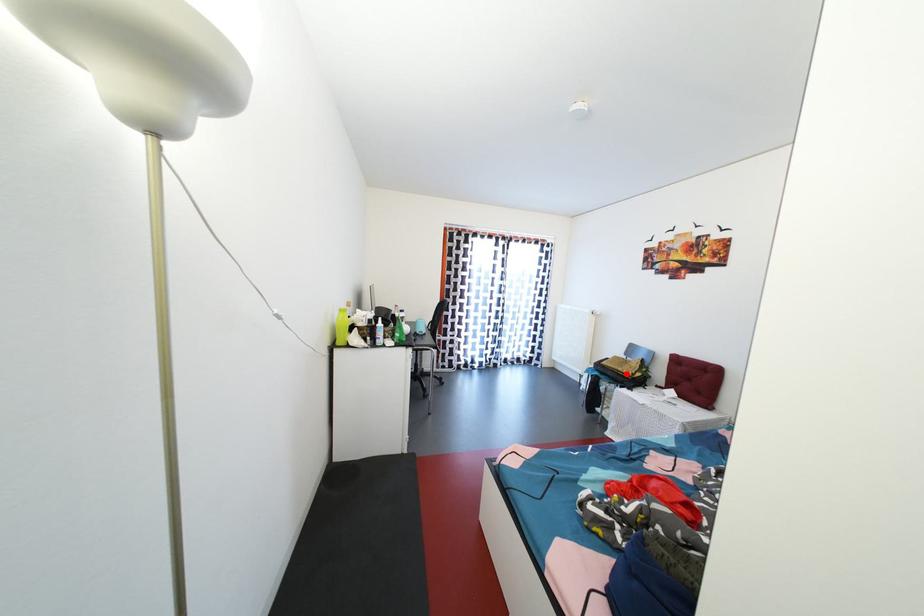
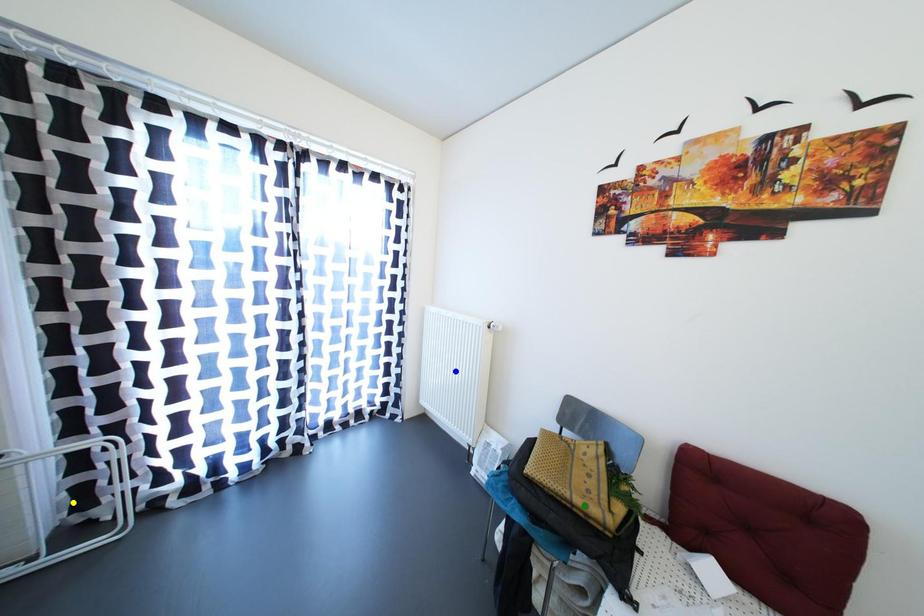
Question: I am providing you with two images of the same scene from different viewpoints. A red point is marked on the first image. You are given multiple points on the second image. In image 2, which mark is for the same physical point as the one in image 1?

Choices:
 (A) green point
 (B) blue point
 (C) yellow point

Answer: (A)